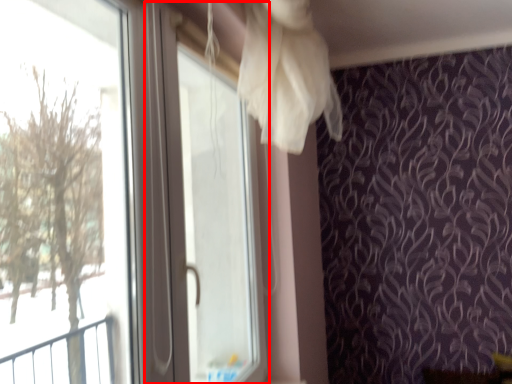
Question: In this image, where is screen door (annotated by the red box) located relative to window?

Choices:
 (A) left
 (B) right

Answer: (B)